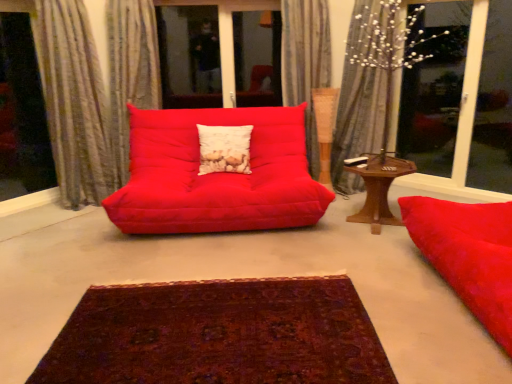
Question: From the image's perspective, is deep burgundy woven rug at center above white textured pillow at center?

Choices:
 (A) no
 (B) yes

Answer: (A)

Question: Does deep burgundy woven rug at center lie in front of white textured pillow at center?

Choices:
 (A) no
 (B) yes

Answer: (B)

Question: Is deep burgundy woven rug at center positioned beyond the bounds of white textured pillow at center?

Choices:
 (A) no
 (B) yes

Answer: (B)

Question: Does deep burgundy woven rug at center have a greater height compared to white textured pillow at center?

Choices:
 (A) no
 (B) yes

Answer: (A)

Question: Is white textured pillow at center a part of deep burgundy woven rug at center?

Choices:
 (A) no
 (B) yes

Answer: (A)

Question: From the image's perspective, is wooden hexagonal table at right above or below silky gray curtain at upper center, the first curtain viewed from the right?

Choices:
 (A) above
 (B) below

Answer: (B)

Question: From their relative heights in the image, would you say wooden hexagonal table at right is taller or shorter than silky gray curtain at upper center, which ranks as the fourth curtain in left-to-right order?

Choices:
 (A) tall
 (B) short

Answer: (B)

Question: From a real-world perspective, relative to silky gray curtain at upper center, which ranks as the fourth curtain in left-to-right order, is wooden hexagonal table at right vertically above or below?

Choices:
 (A) below
 (B) above

Answer: (A)

Question: Is wooden hexagonal table at right spatially inside silky gray curtain at upper center, the first curtain viewed from the right, or outside of it?

Choices:
 (A) outside
 (B) inside

Answer: (A)

Question: From a real-world perspective, is deep burgundy woven rug at center positioned above or below textured beige curtain at upper center, the second curtain in the right-to-left sequence?

Choices:
 (A) below
 (B) above

Answer: (A)

Question: Considering the positions of deep burgundy woven rug at center and textured beige curtain at upper center, the second curtain in the right-to-left sequence, in the image, is deep burgundy woven rug at center taller or shorter than textured beige curtain at upper center, the second curtain in the right-to-left sequence,?

Choices:
 (A) tall
 (B) short

Answer: (B)

Question: In the image, is deep burgundy woven rug at center on the left side or the right side of textured beige curtain at upper center, arranged as the 3th curtain when viewed from the left?

Choices:
 (A) left
 (B) right

Answer: (A)

Question: Considering their positions, is deep burgundy woven rug at center located in front of or behind textured beige curtain at upper center, the second curtain in the right-to-left sequence?

Choices:
 (A) front
 (B) behind

Answer: (A)

Question: Based on their positions, is wooden hexagonal table at right located to the left or right of deep burgundy woven rug at center?

Choices:
 (A) right
 (B) left

Answer: (A)

Question: Is wooden hexagonal table at right in front of or behind deep burgundy woven rug at center in the image?

Choices:
 (A) behind
 (B) front

Answer: (A)